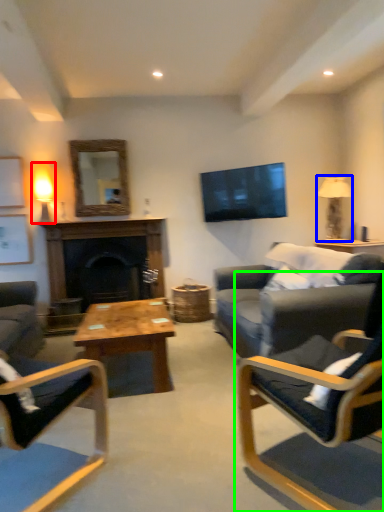
Question: Considering the real-world distances, which object is farthest from lamp (highlighted by a red box)? lamp (highlighted by a blue box) or chair (highlighted by a green box)?

Choices:
 (A) lamp
 (B) chair

Answer: (B)